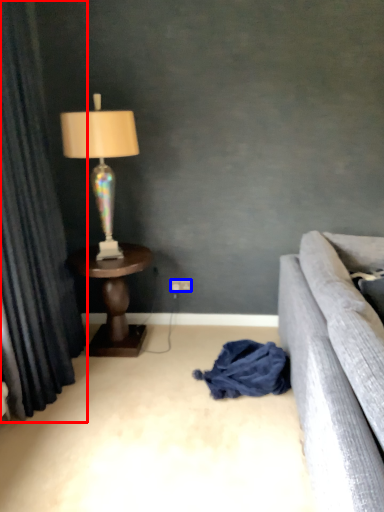
Question: Which object is further to the camera taking this photo, curtain (highlighted by a red box) or power outlet (highlighted by a blue box)?

Choices:
 (A) curtain
 (B) power outlet

Answer: (B)